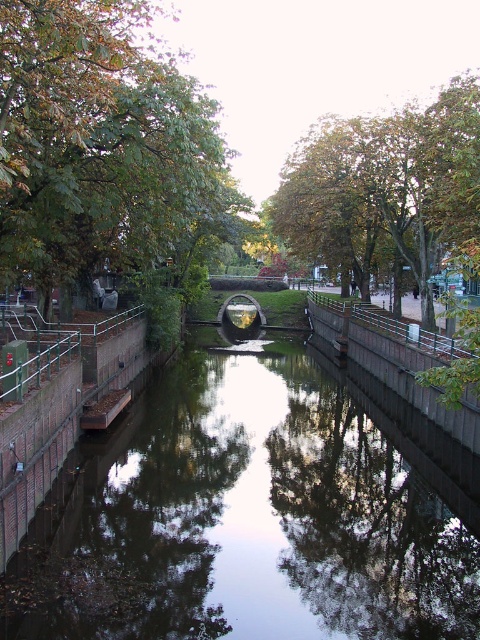
You are a boat captain planning to navigate a boat through the canal. The boat requires a minimum of 15 meters of clearance between the smooth concrete canal at center and the green leafy tree at upper center to safely pass. Based on the scene description, can the boat safely navigate through the canal?

The smooth concrete canal at center and green leafy tree at upper center are 15.72 meters apart from each other. Since 15.72 meters is greater than the required 15 meters of clearance, the boat can safely navigate through the canal.

You are standing on the walkway next to the canal and notice two green leafy trees in the image. Which tree, the green leafy tree at center or the green leafy tree at upper center, appears taller?

The green leafy tree at upper center appears taller than the green leafy tree at center.

From the picture: You are standing at the point with coordinates point (69, 244) and want to walk towards the point with coordinates point (239, 502). Which direction should you move relative to the canal?

You should move towards the point (239, 502), which is in front of the point (69, 244). Since the canal has brick walls with metal railings on both sides, you should walk along the walkway in the direction of the circular structure in the center to reach the desired point.